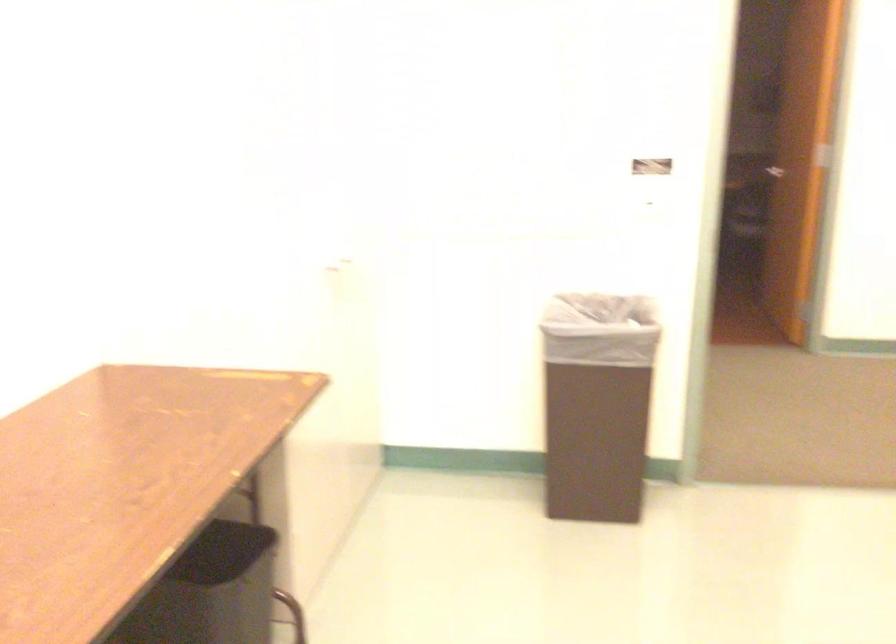
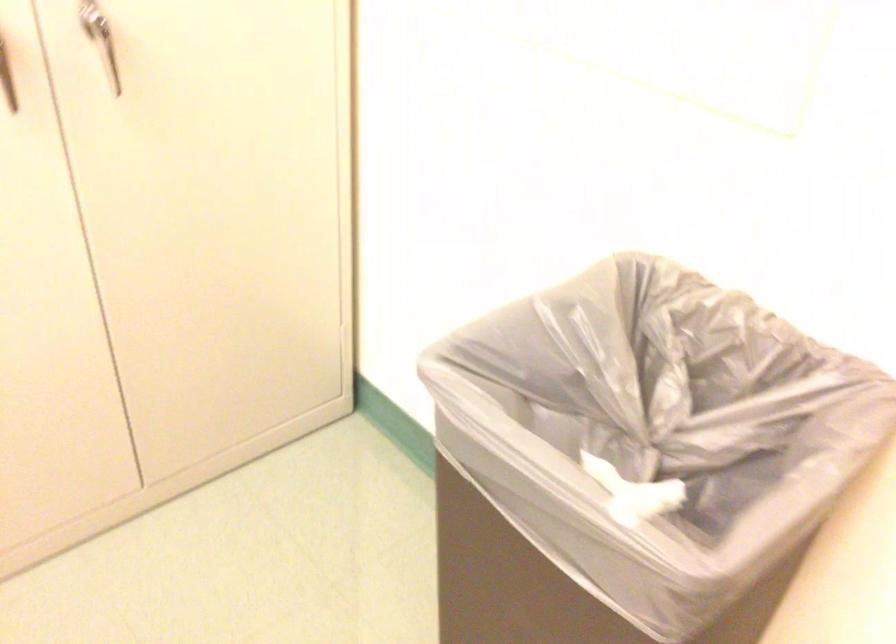
The point at (330, 266) is marked in the first image. Where is the corresponding point in the second image?

(106, 51)